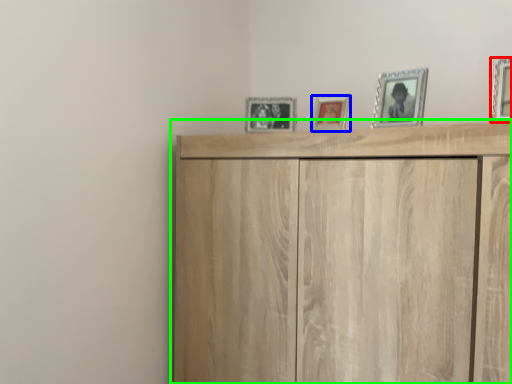
Question: Based on their relative distances, which object is nearer to picture frame (highlighted by a red box)? Choose from picture frame (highlighted by a blue box) and cupboard (highlighted by a green box).

Choices:
 (A) picture frame
 (B) cupboard

Answer: (A)